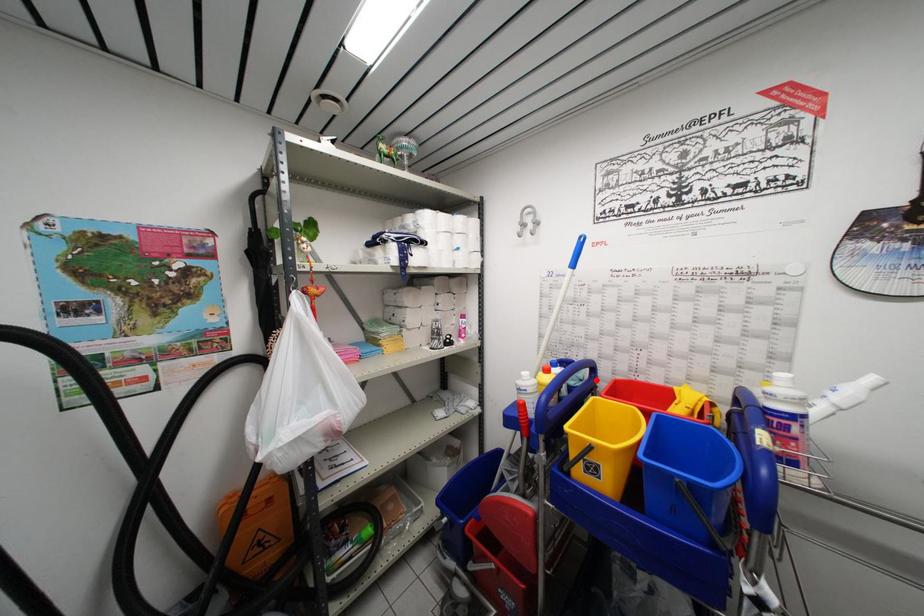
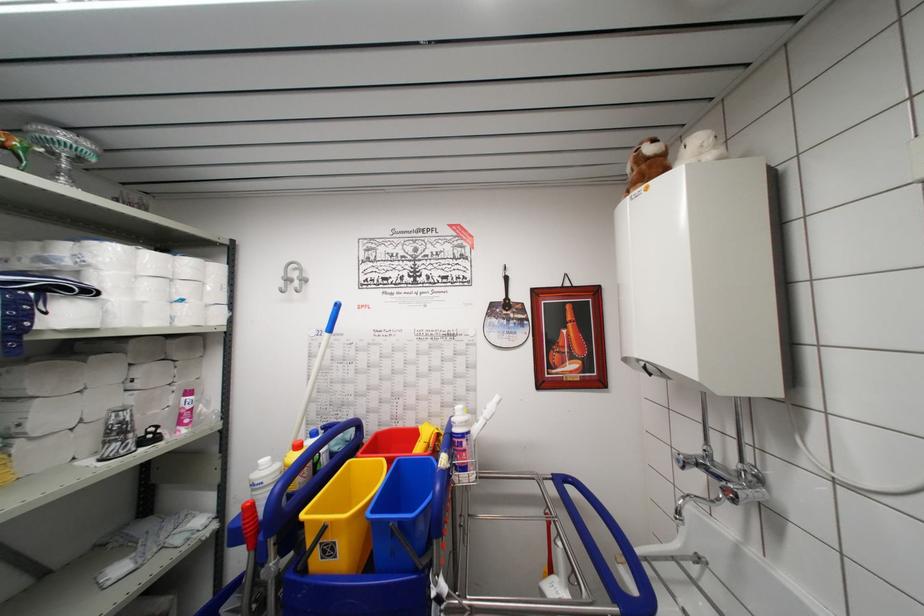
The point at the highlighted location is marked in the first image. Where is the corresponding point in the second image?

(361, 439)